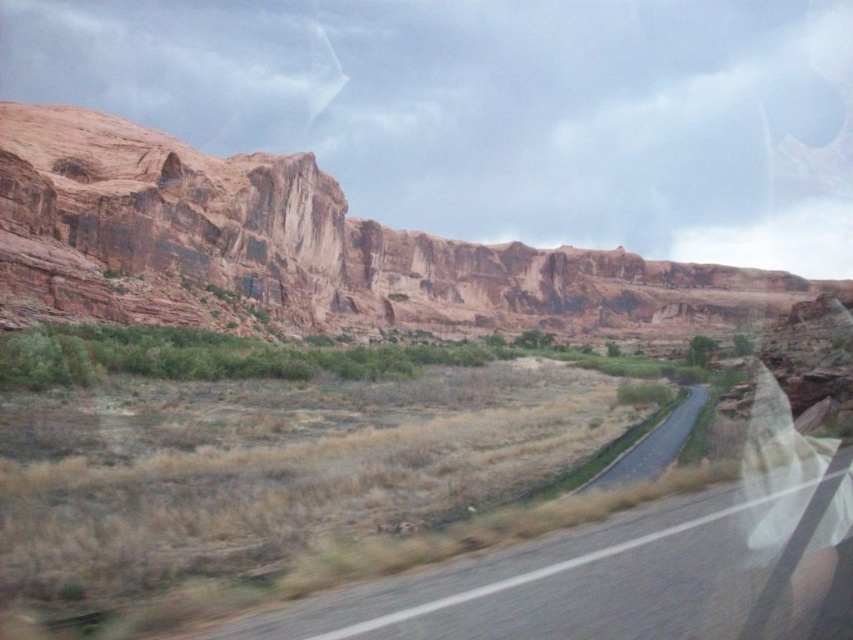
You are a passenger in a car traveling along the gray asphalt road at center. You notice a point marked at coordinate [579,577]. What does this point represent?

The point at coordinate [579,577] represents the gray asphalt road at center.

You are driving a truck that is 2.5 meters wide. You see the gray asphalt road at center and the black asphalt road at center. Which road can your truck safely pass through?

The black asphalt road at center is wider than the gray asphalt road at center, so the truck can safely pass through the black asphalt road at center since its width accommodates the truck.

You are a geologist analyzing the image. You need to locate the rustic rock formation at upper left. What are its coordinates?

The rustic rock formation at upper left is located at coordinates point [303,248].